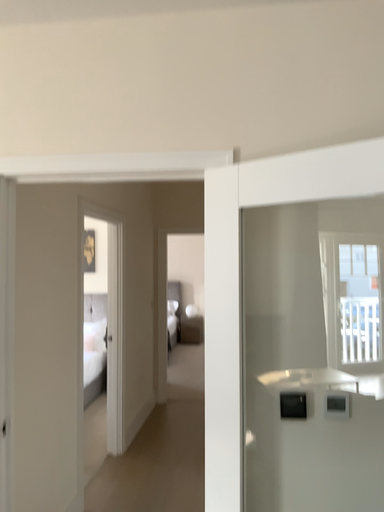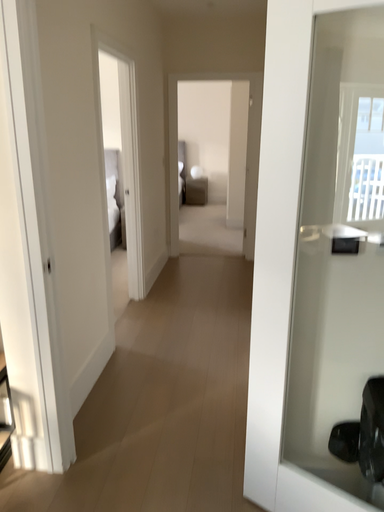
Question: Which way did the camera rotate in the video?

Choices:
 (A) rotated upward
 (B) rotated downward

Answer: (B)